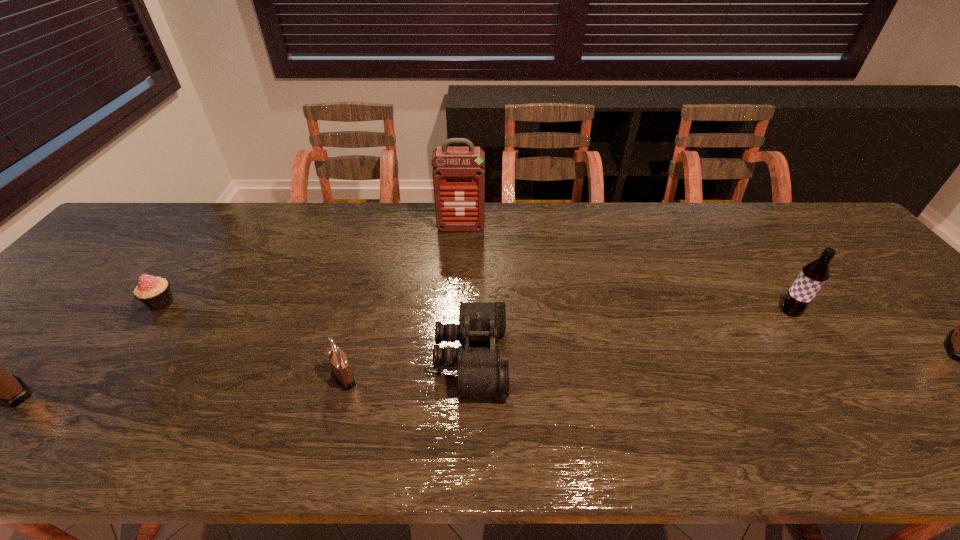
Locate an element on the screen. This screenshot has height=540, width=960. vacant point located on the front of the cupcake is located at coordinates (142, 329).

Find the location of a particular element. Image resolution: width=960 pixels, height=540 pixels. vacant space situated at the eyepieces of the binoculars is located at coordinates (585, 357).

Where is `object located in the far edge section of the desktop`? This screenshot has width=960, height=540. object located in the far edge section of the desktop is located at coordinates (458, 173).

Where is `padlock situated at the near edge`? The image size is (960, 540). padlock situated at the near edge is located at coordinates (343, 374).

Where is `binoculars at the near edge`? binoculars at the near edge is located at coordinates (480, 373).

Where is `free space at the far edge`? Image resolution: width=960 pixels, height=540 pixels. free space at the far edge is located at coordinates (252, 216).

The width and height of the screenshot is (960, 540). What are the coordinates of `vacant space at the near edge` in the screenshot? It's located at (624, 394).

Where is `free region at the right edge`? free region at the right edge is located at coordinates (842, 252).

The height and width of the screenshot is (540, 960). Find the location of `free spot at the far left corner of the desktop`. free spot at the far left corner of the desktop is located at coordinates (119, 235).

Find the location of a particular element. Image resolution: width=960 pixels, height=540 pixels. vacant area between the sixth object from left to right and the first-aid kit is located at coordinates (626, 269).